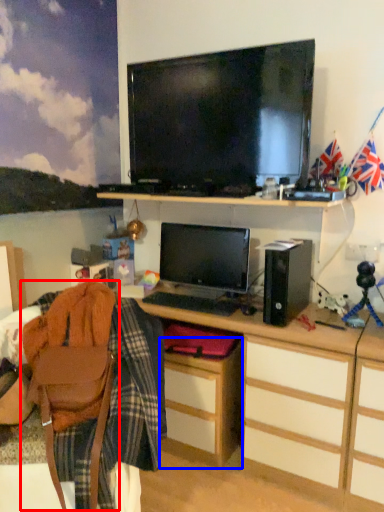
Question: Which object appears farthest to the camera in this image, swivel chair (highlighted by a red box) or cabinetry (highlighted by a blue box)?

Choices:
 (A) swivel chair
 (B) cabinetry

Answer: (B)